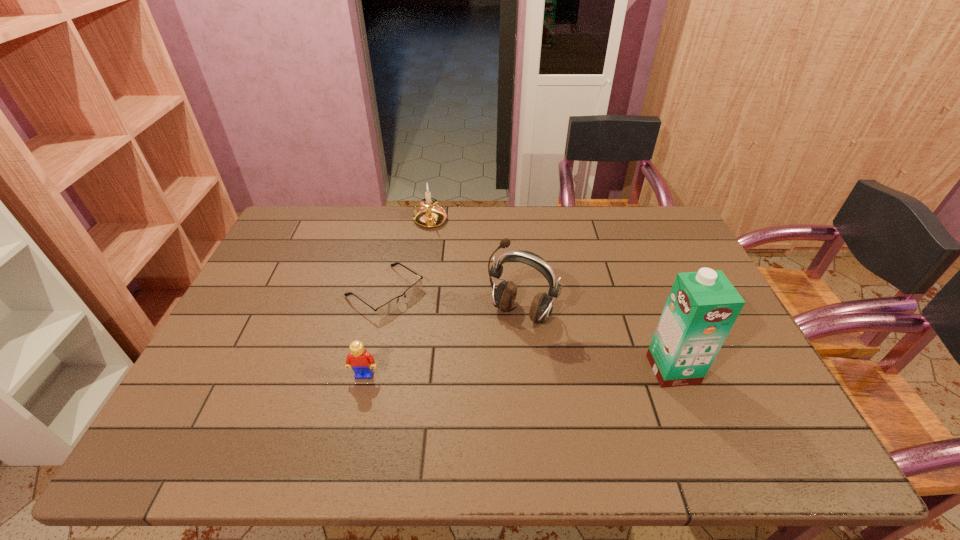
Locate an element on the screen. free space on the desktop that is between the second shortest object and the rightmost object and is positioned on the front-facing side of the spectacles is located at coordinates (501, 373).

Where is `free space on the desktop that is between the Lego and the tallest object and is positioned on the ear pads of the second tallest object`? The image size is (960, 540). free space on the desktop that is between the Lego and the tallest object and is positioned on the ear pads of the second tallest object is located at coordinates (486, 373).

Locate an element on the screen. This screenshot has width=960, height=540. free spot on the desktop that is between the fourth tallest object and the tallest object and is positioned on the handle side of the candle holder is located at coordinates (498, 373).